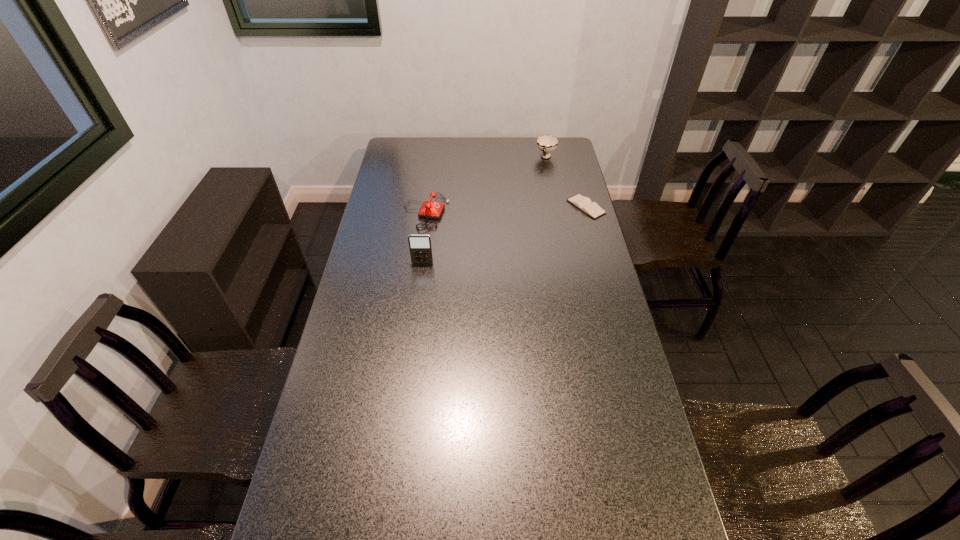
Identify the location of free point between the third shortest object and the third tallest object. (486, 185).

Locate an element on the screen. The height and width of the screenshot is (540, 960). object that stands as the third closest to the second tallest object is located at coordinates (420, 247).

Locate which object is the third closest to the cup. Please provide its 2D coordinates. Your answer should be formatted as a tuple, i.e. [(x, y)], where the tuple contains the x and y coordinates of a point satisfying the conditions above.

[(420, 247)]

Locate an element on the screen. The image size is (960, 540). free space that satisfies the following two spatial constraints: 1. on the front side of the shortest object; 2. on the right side of the farthest object is located at coordinates (556, 207).

Locate an element on the screen. The image size is (960, 540). blank space that satisfies the following two spatial constraints: 1. on the front side of the farthest object; 2. on the right side of the diary is located at coordinates (556, 207).

At what (x,y) coordinates should I click in order to perform the action: click on vacant position in the image that satisfies the following two spatial constraints: 1. on the back side of the shortest object; 2. on the left side of the telephone. Please return your answer as a coordinate pair (x, y). Looking at the image, I should click on (426, 207).